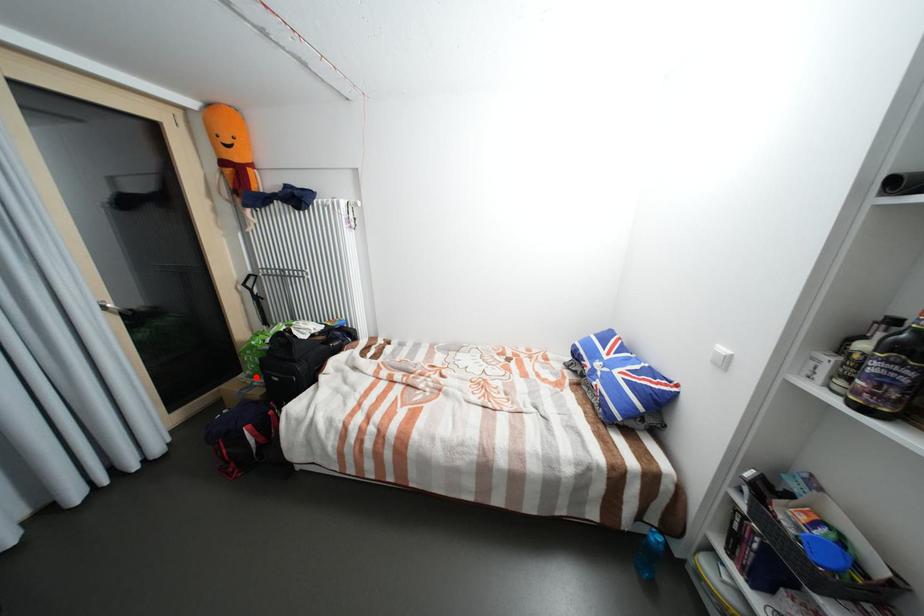
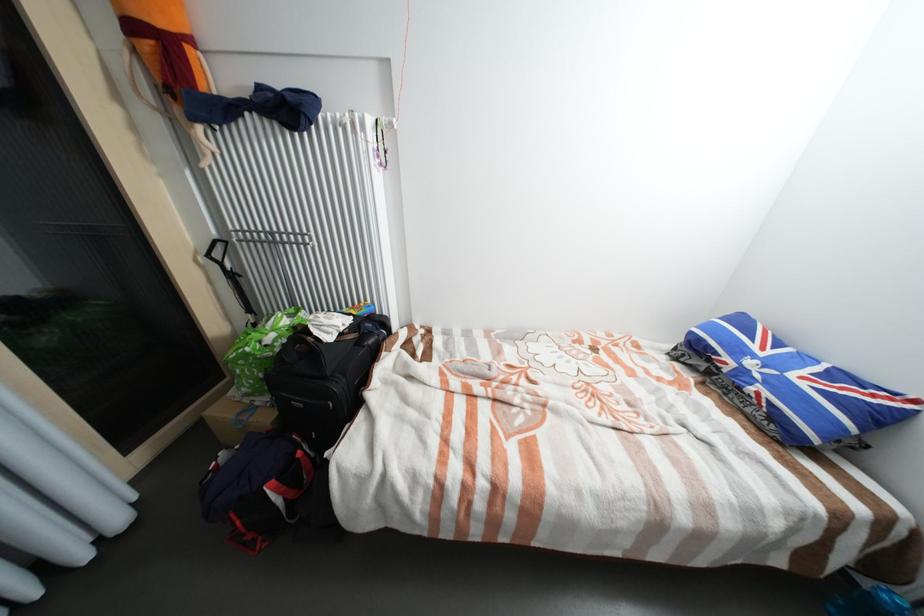
Locate, in the second image, the point that corresponds to the highlighted location in the first image.

(253, 395)